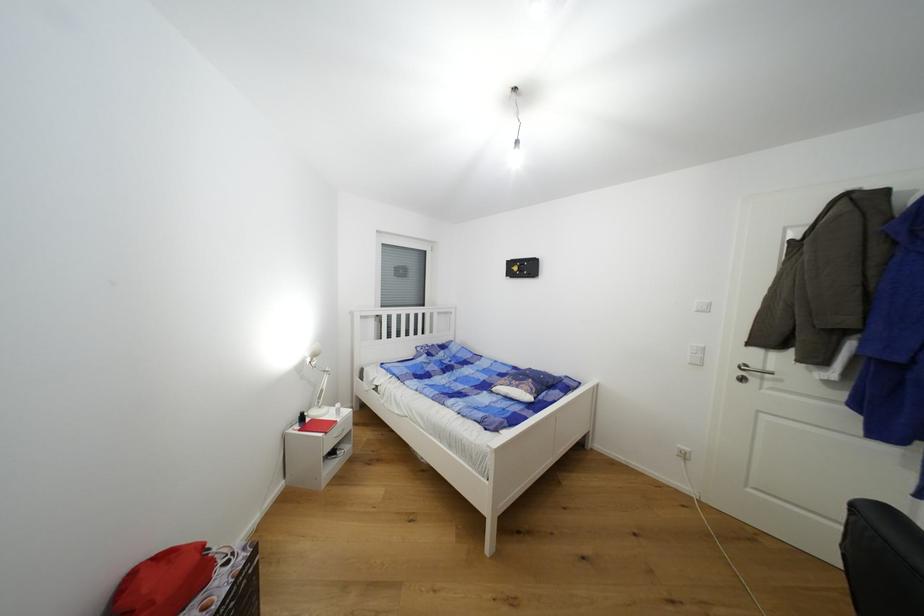
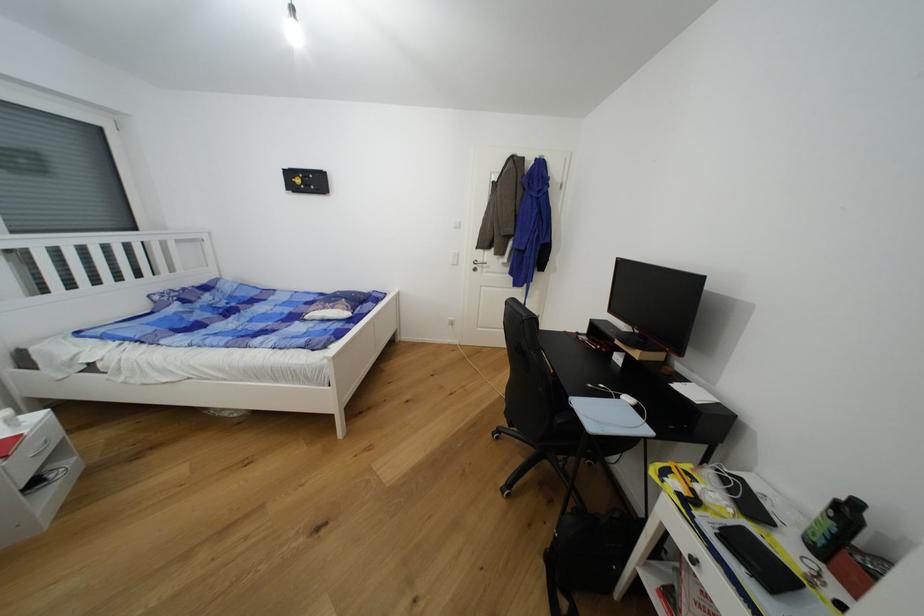
Find the pixel in the second image that matches pixel 760 368 in the first image.

(484, 262)